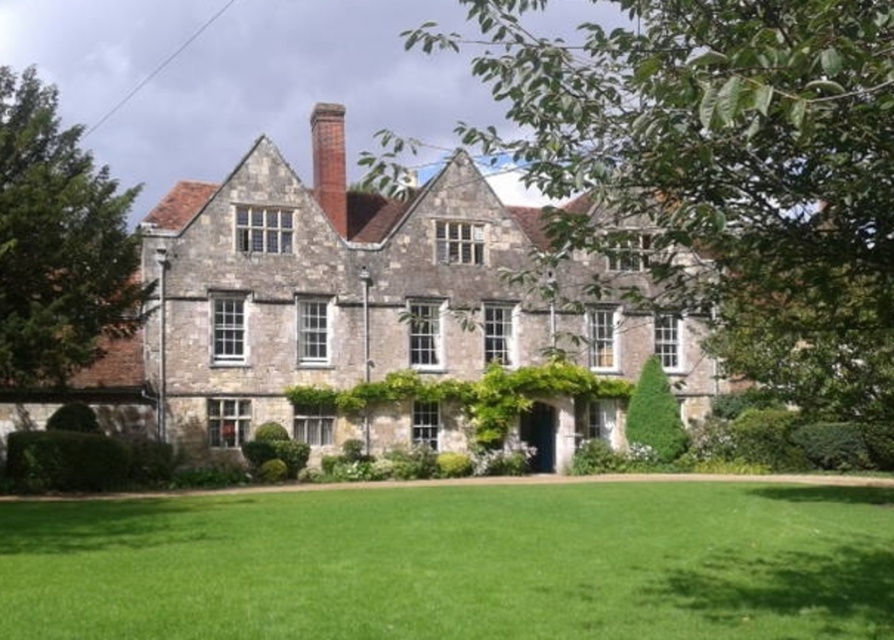
Which is in front, point (326, 529) or point (697, 147)?

Point (697, 147) is in front.

Does point (221, 556) come farther from viewer compared to point (741, 150)?

Yes.

Is point (300, 577) farther from camera compared to point (764, 164)?

Yes, point (300, 577) is farther from viewer.

I want to click on green grass at lower center, so click(x=454, y=563).

Does green leafy tree at center have a larger size compared to red brick chimney at center?

Yes, green leafy tree at center is bigger than red brick chimney at center.

Describe the element at coordinates (724, 176) in the screenshot. I see `green leafy tree at center` at that location.

You are a GUI agent. You are given a task and a screenshot of the screen. Output one action in this format:
    pyautogui.click(x=<x>, y=<y>)
    Task: Click on the green leafy tree at center
    The height and width of the screenshot is (640, 894).
    Given the screenshot: What is the action you would take?
    pyautogui.click(x=724, y=176)

Which is above, green leafy tree at upper left or red brick chimney at center?

red brick chimney at center is above.

Is green leafy tree at upper left to the right of red brick chimney at center from the viewer's perspective?

In fact, green leafy tree at upper left is to the left of red brick chimney at center.

At what (x,y) coordinates should I click in order to perform the action: click on green leafy tree at upper left. Please return your answer as a coordinate pair (x, y). This screenshot has height=640, width=894. Looking at the image, I should click on (58, 243).